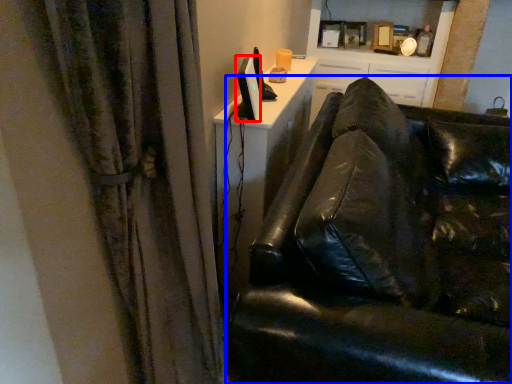
Question: Which object is further to the camera taking this photo, computer monitor (highlighted by a red box) or studio couch (highlighted by a blue box)?

Choices:
 (A) computer monitor
 (B) studio couch

Answer: (A)